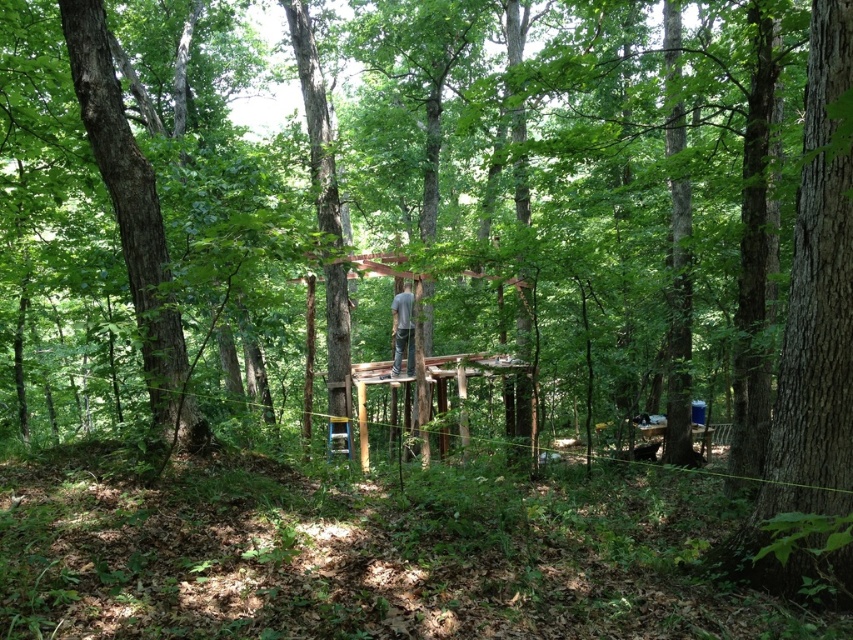
Between smooth brown tree trunk at left and gray fabric shirt at center, which one has less height?

Standing shorter between the two is gray fabric shirt at center.

Is smooth brown tree trunk at left thinner than gray fabric shirt at center?

No, smooth brown tree trunk at left is not thinner than gray fabric shirt at center.

The height and width of the screenshot is (640, 853). Identify the location of smooth brown tree trunk at left. (132, 225).

Image resolution: width=853 pixels, height=640 pixels. What do you see at coordinates (402, 330) in the screenshot?
I see `gray fabric shirt at center` at bounding box center [402, 330].

Who is shorter, gray fabric shirt at center or green plastic ladder at center?

green plastic ladder at center is shorter.

What do you see at coordinates (402, 330) in the screenshot? I see `gray fabric shirt at center` at bounding box center [402, 330].

Where is `gray fabric shirt at center`? The height and width of the screenshot is (640, 853). gray fabric shirt at center is located at coordinates (402, 330).

Which of these two, smooth brown tree trunk at left or green plastic ladder at center, stands shorter?

Standing shorter between the two is green plastic ladder at center.

Between smooth brown tree trunk at left and green plastic ladder at center, which one is positioned lower?

Positioned lower is green plastic ladder at center.

Where is `smooth brown tree trunk at left`? smooth brown tree trunk at left is located at coordinates (132, 225).

Identify the location of smooth brown tree trunk at left. (132, 225).